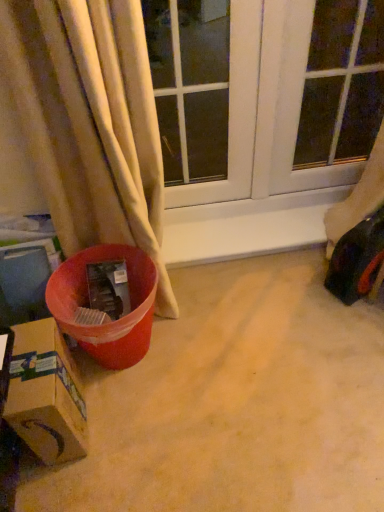
Where is `cardboard box at lower left`? The width and height of the screenshot is (384, 512). cardboard box at lower left is located at coordinates (x=46, y=394).

What do you see at coordinates (190, 85) in the screenshot?
I see `transparent glass window at center` at bounding box center [190, 85].

What is the approximate width of transparent glass window screen at upper right?

transparent glass window screen at upper right is 7.56 centimeters in width.

Locate an element on the screen. The height and width of the screenshot is (512, 384). cardboard box at lower left is located at coordinates (46, 394).

Is the position of transparent glass window at center less distant than that of shiny plastic toy car at right?

Yes.

Does transparent glass window at center turn towards shiny plastic toy car at right?

No, transparent glass window at center does not turn towards shiny plastic toy car at right.

From a real-world perspective, is transparent glass window at center physically located above or below shiny plastic toy car at right?

transparent glass window at center is situated higher than shiny plastic toy car at right in the real world.

Looking at this image, considering the relative sizes of transparent glass window at center and shiny plastic toy car at right in the image provided, is transparent glass window at center bigger than shiny plastic toy car at right?

Indeed, transparent glass window at center has a larger size compared to shiny plastic toy car at right.

Considering the positions of objects cardboard box at lower left and shiny plastic toy car at right in the image provided, who is in front, cardboard box at lower left or shiny plastic toy car at right?

cardboard box at lower left is in front.

From a real-world perspective, is cardboard box at lower left physically located above or below shiny plastic toy car at right?

Clearly, from a real-world perspective, cardboard box at lower left is below shiny plastic toy car at right.

Which object is thinner, cardboard box at lower left or shiny plastic toy car at right?

Thinner between the two is shiny plastic toy car at right.

Does point (49, 426) lie in front of point (340, 259)?

Yes, it is.

Is point (295, 160) behind point (157, 77)?

That is False.

Is transparent glass window screen at upper right oriented towards transparent glass window at center?

No, transparent glass window screen at upper right is not oriented towards transparent glass window at center.

Can you confirm if transparent glass window screen at upper right is bigger than transparent glass window at center?

Actually, transparent glass window screen at upper right might be smaller than transparent glass window at center.

Does transparent glass window screen at upper right appear on the right side of transparent glass window at center?

Correct, you'll find transparent glass window screen at upper right to the right of transparent glass window at center.

Which object is further away from the camera, shiny plastic toy car at right or transparent glass window screen at upper right?

shiny plastic toy car at right is further from the camera.

Considering the positions of objects shiny plastic toy car at right and transparent glass window screen at upper right in the image provided, who is more to the left, shiny plastic toy car at right or transparent glass window screen at upper right?

Positioned to the left is transparent glass window screen at upper right.

At what (x,y) coordinates should I click in order to perform the action: click on window screen above the shiny plastic toy car at right (from the image's perspective). Please return your answer as a coordinate pair (x, y). Image resolution: width=384 pixels, height=512 pixels. Looking at the image, I should click on (342, 83).

How different are the orientations of shiny plastic toy car at right and transparent glass window screen at upper right in degrees?

The angle between the facing direction of shiny plastic toy car at right and the facing direction of transparent glass window screen at upper right is 23.9 degrees.

Is shiny plastic toy car at right at the right side of transparent glass window at center?

Correct, you'll find shiny plastic toy car at right to the right of transparent glass window at center.

Measure the distance from shiny plastic toy car at right to transparent glass window at center.

shiny plastic toy car at right is 3.33 feet from transparent glass window at center.

Would you say transparent glass window at center is part of shiny plastic toy car at right's contents?

Definitely not — transparent glass window at center is not inside shiny plastic toy car at right.

Is shiny plastic toy car at right thinner than transparent glass window at center?

No.

From a real-world perspective, between cardboard box at lower left and transparent glass window at center, who is vertically higher?

transparent glass window at center.

Does cardboard box at lower left appear on the right side of transparent glass window at center?

In fact, cardboard box at lower left is to the left of transparent glass window at center.

Is cardboard box at lower left facing away from transparent glass window at center?

No, cardboard box at lower left is not facing away from transparent glass window at center.

Between transparent glass window screen at upper right and cardboard box at lower left, which one has less height?

cardboard box at lower left.

Is transparent glass window screen at upper right facing away from cardboard box at lower left?

No, transparent glass window screen at upper right's orientation is not away from cardboard box at lower left.

Is transparent glass window screen at upper right to the right of cardboard box at lower left from the viewer's perspective?

Indeed, transparent glass window screen at upper right is positioned on the right side of cardboard box at lower left.

Is transparent glass window screen at upper right placed right next to cardboard box at lower left?

There is a gap between transparent glass window screen at upper right and cardboard box at lower left.

I want to click on toy car below the transparent glass window at center (from the image's perspective), so click(357, 260).

At what (x,y) coordinates should I click in order to perform the action: click on box on the left of shiny plastic toy car at right. Please return your answer as a coordinate pair (x, y). The image size is (384, 512). Looking at the image, I should click on (46, 394).

Estimate the real-world distances between objects in this image. Which object is closer to shiny plastic toy car at right, cardboard box at lower left or transparent glass window screen at upper right?

cardboard box at lower left lies closer to shiny plastic toy car at right than the other object.

Based on the photo, based on their spatial positions, is shiny plastic toy car at right or transparent glass window screen at upper right further from cardboard box at lower left?

transparent glass window screen at upper right is positioned further to the anchor cardboard box at lower left.

From the image, which object appears to be nearer to cardboard box at lower left, transparent glass window at center or shiny plastic toy car at right?

The object closer to cardboard box at lower left is shiny plastic toy car at right.

Based on their spatial positions, is shiny plastic toy car at right or transparent glass window at center closer to transparent glass window screen at upper right?

transparent glass window at center is positioned closer to the anchor transparent glass window screen at upper right.

When comparing their distances from cardboard box at lower left, does transparent glass window screen at upper right or transparent glass window at center seem closer?

transparent glass window at center lies closer to cardboard box at lower left than the other object.

Considering their positions, is transparent glass window screen at upper right positioned further to transparent glass window at center than shiny plastic toy car at right?

shiny plastic toy car at right is further to transparent glass window at center.

Looking at this image, which object lies nearer to the anchor point transparent glass window at center, transparent glass window screen at upper right or cardboard box at lower left?

transparent glass window screen at upper right lies closer to transparent glass window at center than the other object.

Estimate the real-world distances between objects in this image. Which object is further from transparent glass window screen at upper right, transparent glass window at center or cardboard box at lower left?

cardboard box at lower left is further to transparent glass window screen at upper right.

This screenshot has height=512, width=384. I want to click on window screen located between transparent glass window at center and shiny plastic toy car at right in the left-right direction, so pos(342,83).

Locate an element on the screen. window screen between cardboard box at lower left and shiny plastic toy car at right in the horizontal direction is located at coordinates (342, 83).

Identify the location of window situated between cardboard box at lower left and shiny plastic toy car at right from left to right. This screenshot has width=384, height=512. (190, 85).

Locate an element on the screen. window between transparent glass window screen at upper right and cardboard box at lower left from top to bottom is located at coordinates (190, 85).